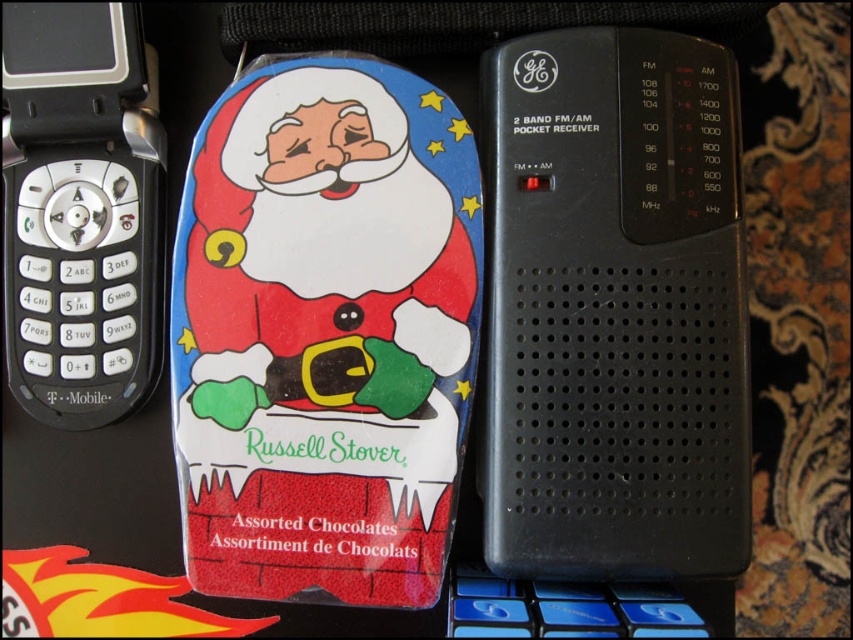
You are holding a camera and want to take a photo of the Russell Stover Assorted Chocolates package. The package is located at the center of the image. There is a point marked at coordinates point (347, 109) that is 1.05 meters away from the camera. Can you determine if the Russell Stover Assorted Chocolates package is within the camera frame?

The Russell Stover Assorted Chocolates package is located at the center of the image. The point marked at coordinates point (347, 109) is 1.05 meters away from the camera. Since the package is at the center, it should be within the camera frame as the point is within the frame and the distance is reasonable for capturing the image.

You are organizing a holiday display and need to place the glossy plastic santa claus at center and the black plastic radio at center right. According to the scene, which object is located below the other?

The glossy plastic santa claus at center is positioned under the black plastic radio at center right, so the Santa Claus is below the radio.

You are a delivery person who needs to place a new Russell Stover Assorted Chocolates package on the table. The current arrangement has a T Mobile flip phone on the left and a black plastic radio at center right. Where should you place the new package so it doesn t overlap with existing items?

Place the new Russell Stover Assorted Chocolates package in the center of the table, between the T Mobile flip phone on the left and the black plastic radio at center right, since there is space available in the middle area not occupied by either item.